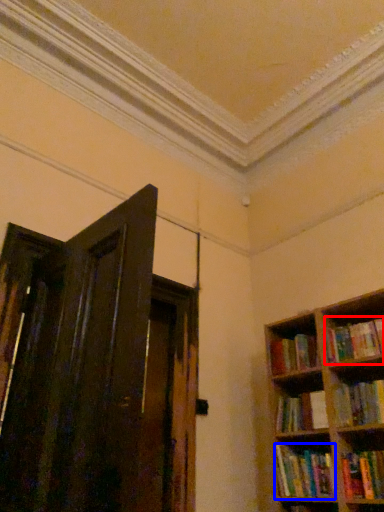
Question: Which object is closer to the camera taking this photo, book (highlighted by a red box) or book (highlighted by a blue box)?

Choices:
 (A) book
 (B) book

Answer: (B)